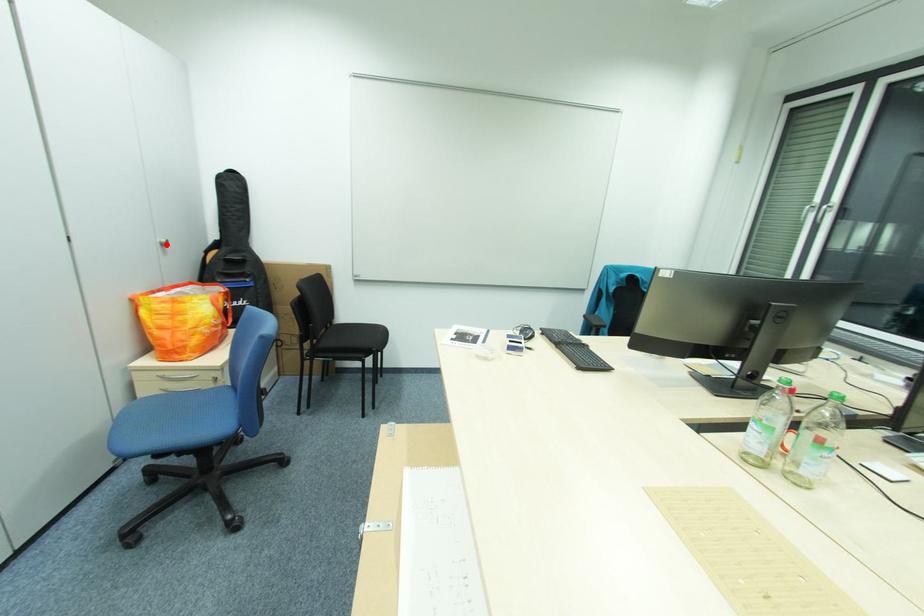
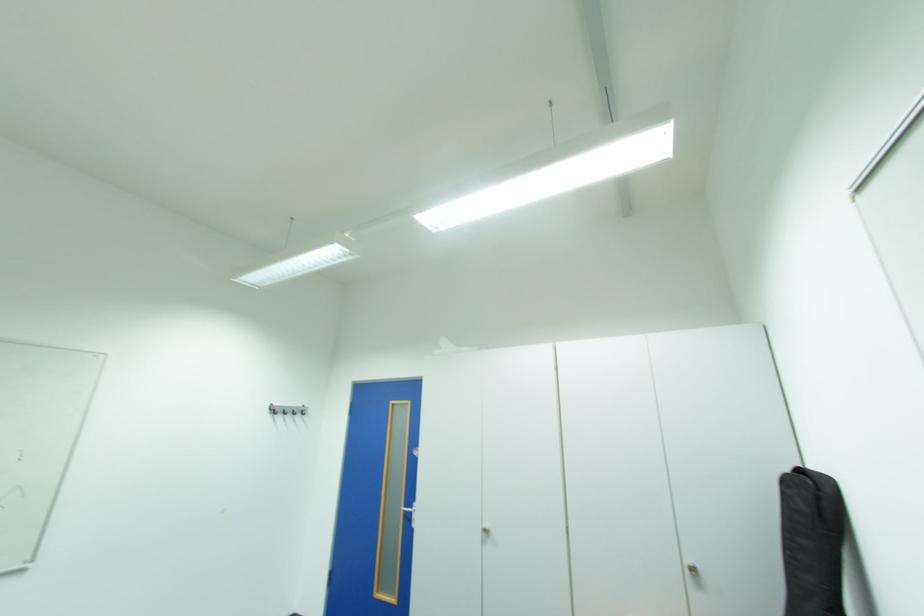
The point at the highlighted location is marked in the first image. Where is the corresponding point in the second image?

(697, 570)